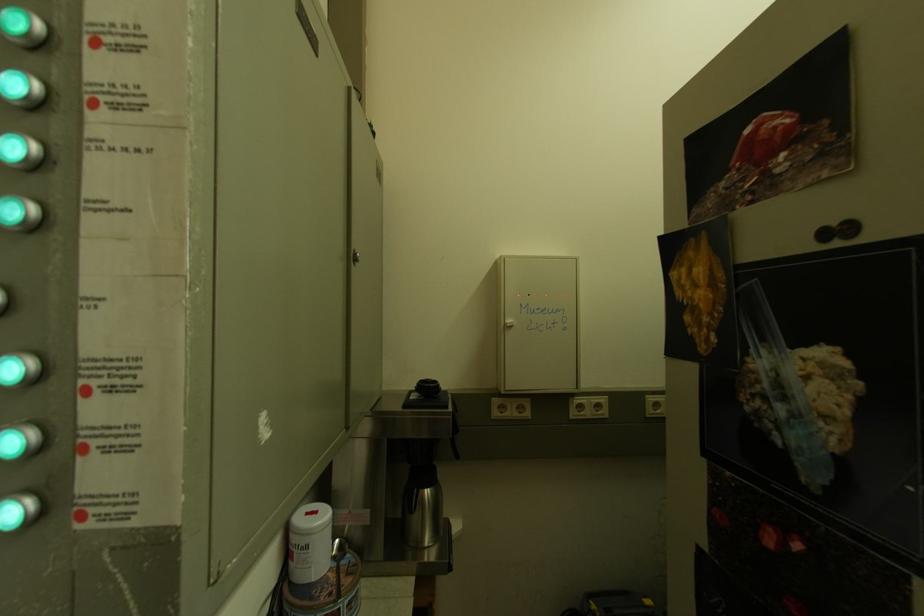
Describe the element at coordinates (538, 323) in the screenshot. I see `the white box handle` at that location.